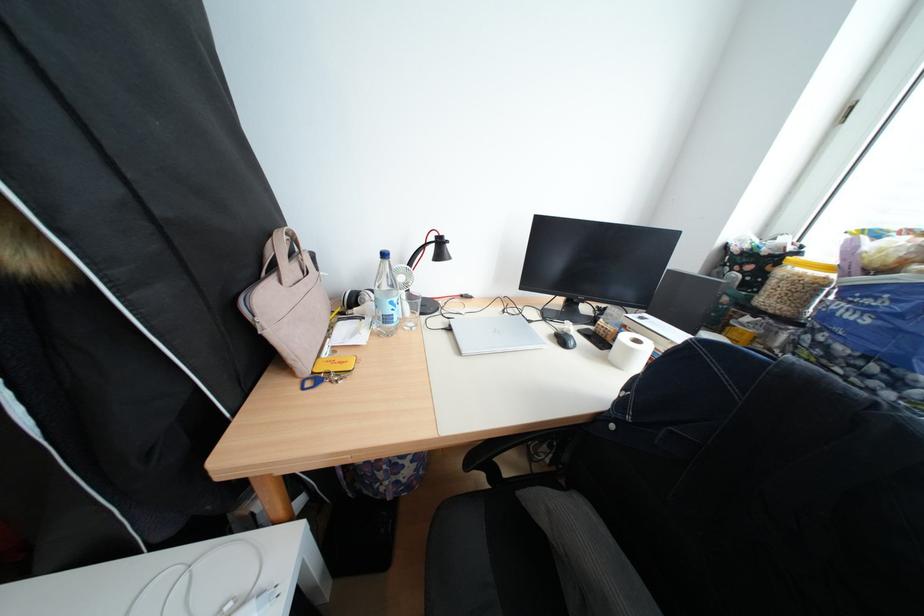
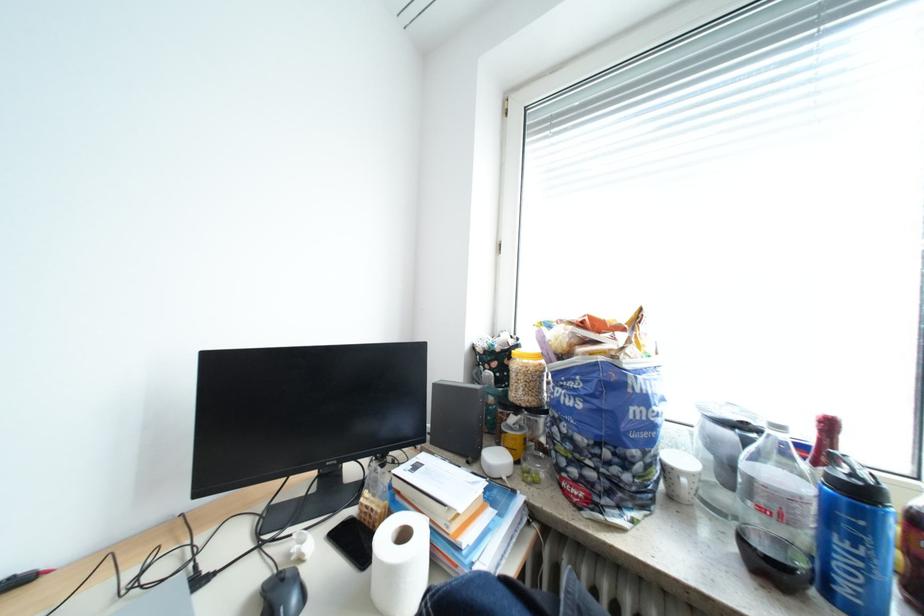
Locate, in the second image, the point that corresponds to [777,301] in the first image.

(529, 394)